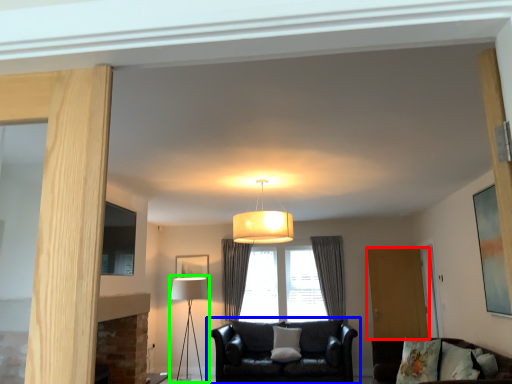
Question: Which is farther away from screen door (highlighted by a red box)? studio couch (highlighted by a blue box) or table lamp (highlighted by a green box)?

Choices:
 (A) studio couch
 (B) table lamp

Answer: (B)